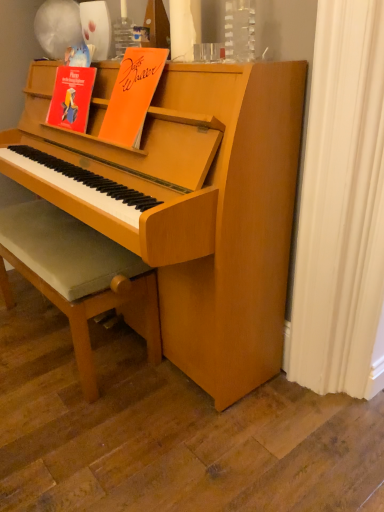
Question: In the image, is orange matte paper at upper center on the left side or the right side of light brown wooden footrest at lower left?

Choices:
 (A) left
 (B) right

Answer: (B)

Question: Does point (130, 79) appear closer or farther from the camera than point (64, 251)?

Choices:
 (A) closer
 (B) farther

Answer: (A)

Question: From the image's perspective, is orange matte paper at upper center positioned above or below light brown wooden footrest at lower left?

Choices:
 (A) above
 (B) below

Answer: (A)

Question: Does point (x=132, y=262) appear closer or farther from the camera than point (x=122, y=137)?

Choices:
 (A) farther
 (B) closer

Answer: (A)

Question: From the image's perspective, relative to orange matte paper at upper center, is light brown wooden footrest at lower left above or below?

Choices:
 (A) below
 (B) above

Answer: (A)

Question: Based on their sizes in the image, would you say light brown wooden footrest at lower left is bigger or smaller than orange matte paper at upper center?

Choices:
 (A) small
 (B) big

Answer: (B)

Question: From a real-world perspective, is light brown wooden footrest at lower left physically located above or below orange matte paper at upper center?

Choices:
 (A) above
 (B) below

Answer: (B)